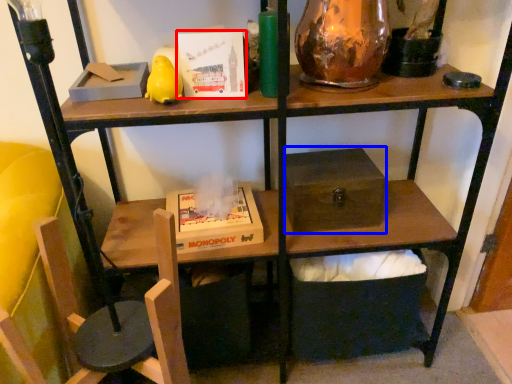
Question: Which point is closer to the camera, paperback book (highlighted by a red box) or box (highlighted by a blue box)?

Choices:
 (A) paperback book
 (B) box

Answer: (A)